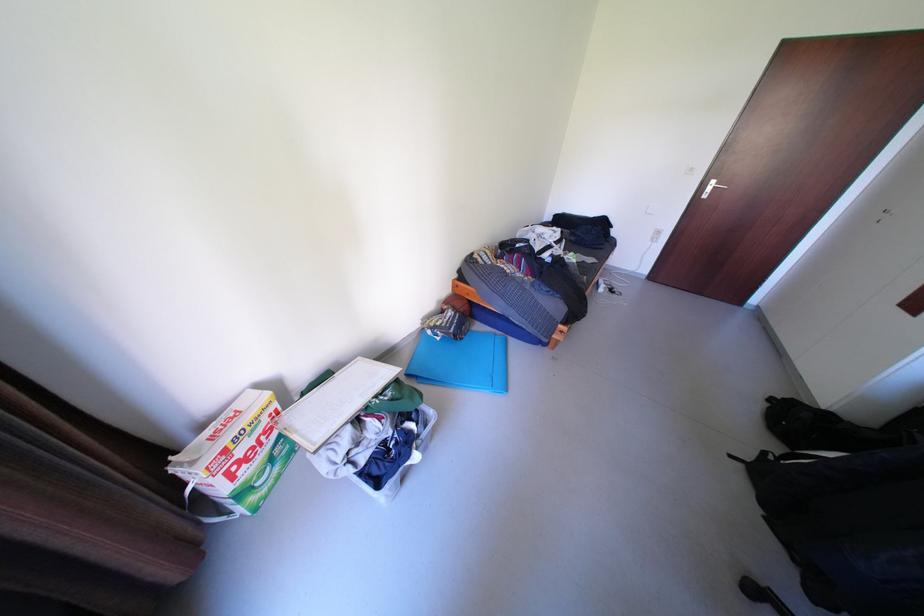
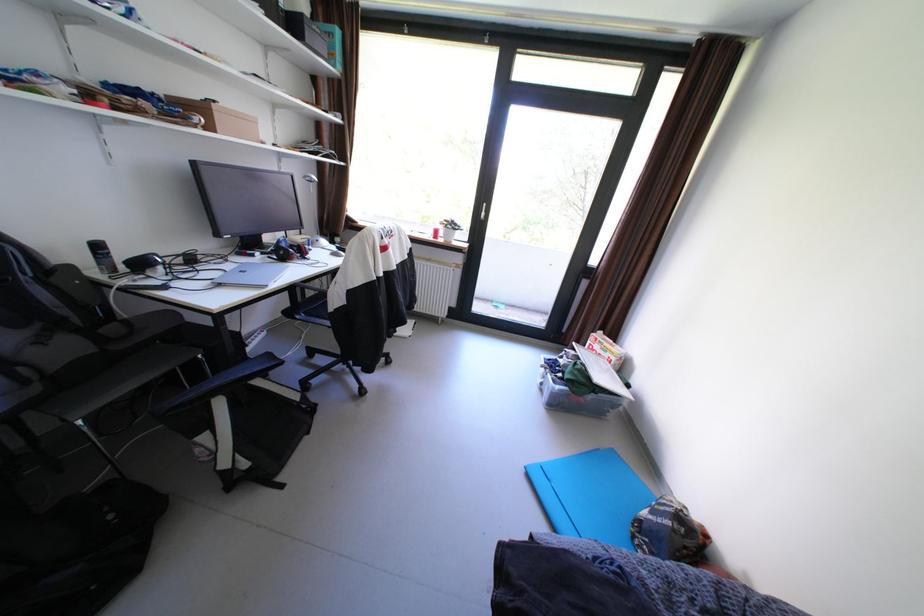
Locate, in the second image, the point that corresponds to point (372, 459) in the first image.

(572, 361)